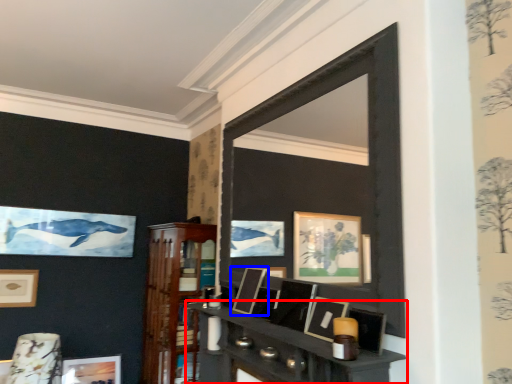
Question: Which of the following is the farthest to the observer, shelf (highlighted by a red box) or picture frame (highlighted by a blue box)?

Choices:
 (A) shelf
 (B) picture frame

Answer: (B)